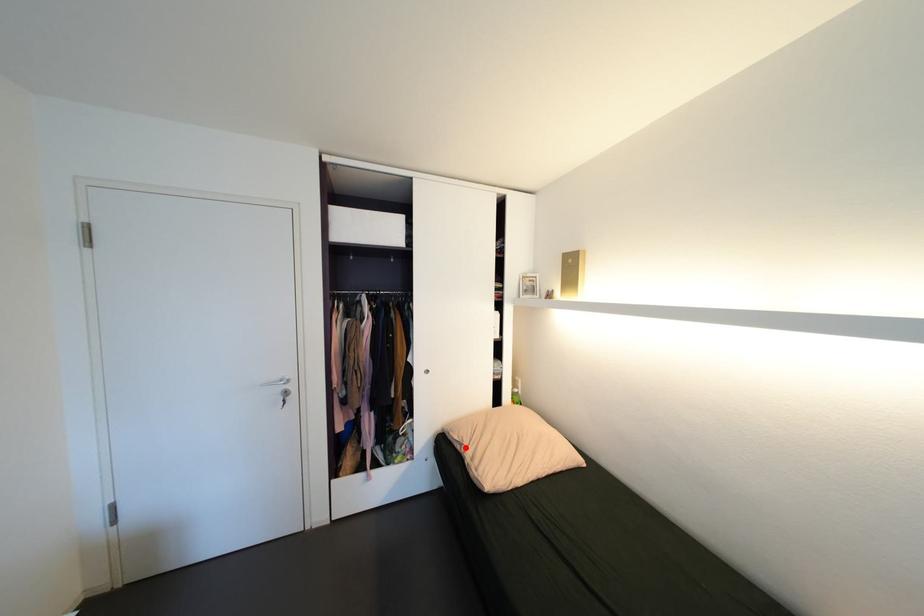
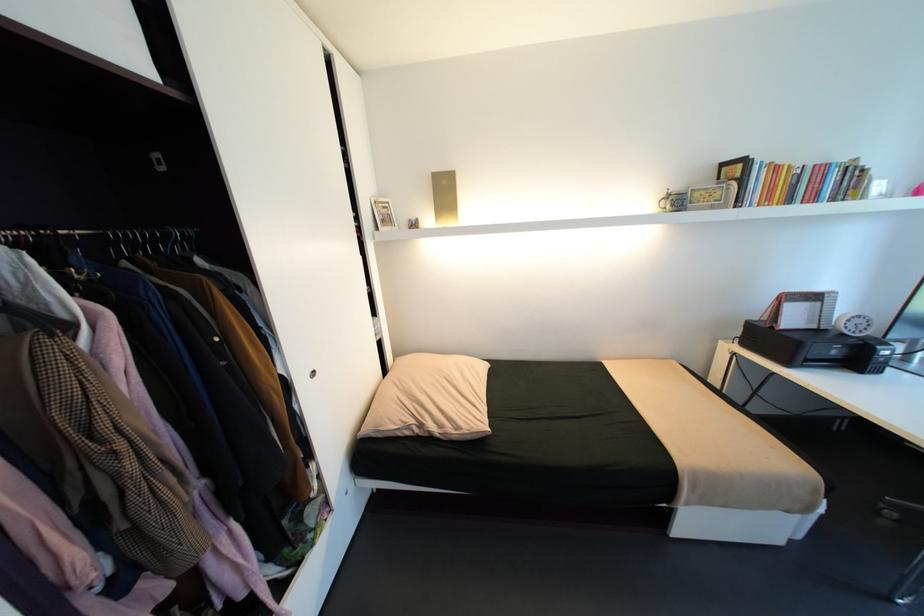
The point at the highlighted location is marked in the first image. Where is the corresponding point in the second image?

(415, 432)